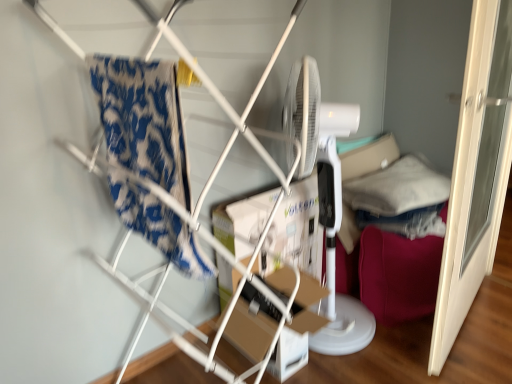
I want to click on free space in front of velvet pink bean bag chair at right, so click(x=451, y=349).